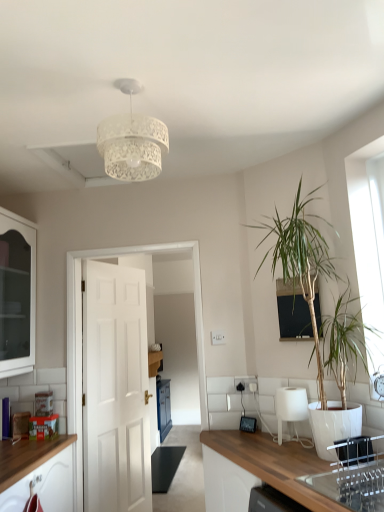
Find the location of a particular element. The image size is (384, 512). free space above white glossy lampshade at lower center (from a real-world perspective) is located at coordinates (293, 391).